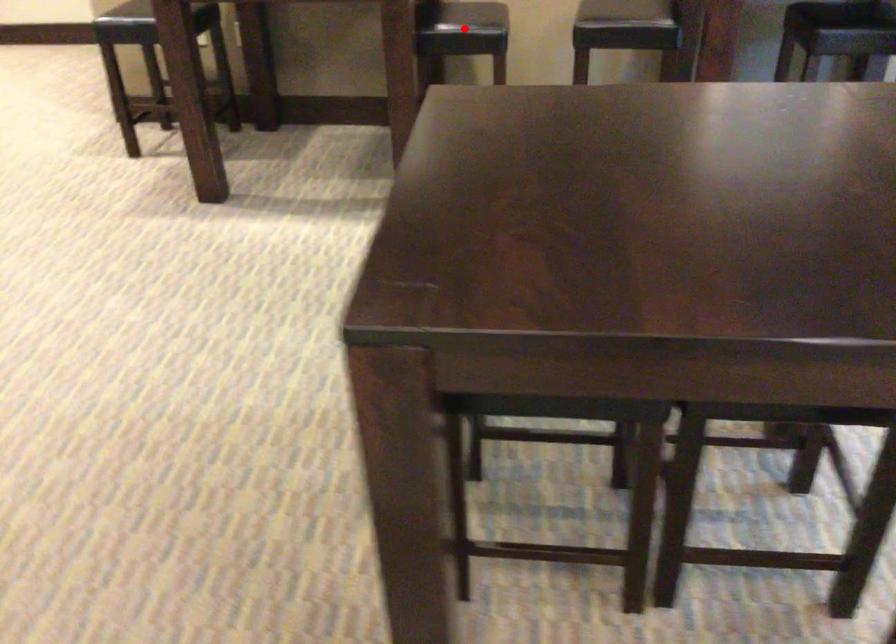
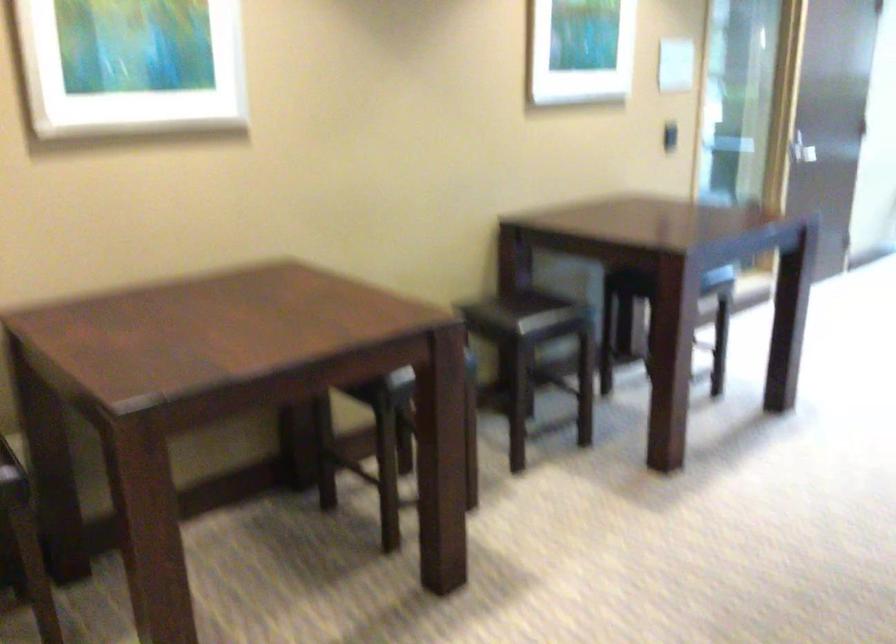
Question: I am providing you with two images of the same scene from different viewpoints. A red point is marked on the first image. Can you still see the location of the red point in image 2?

Choices:
 (A) Yes
 (B) No

Answer: (B)